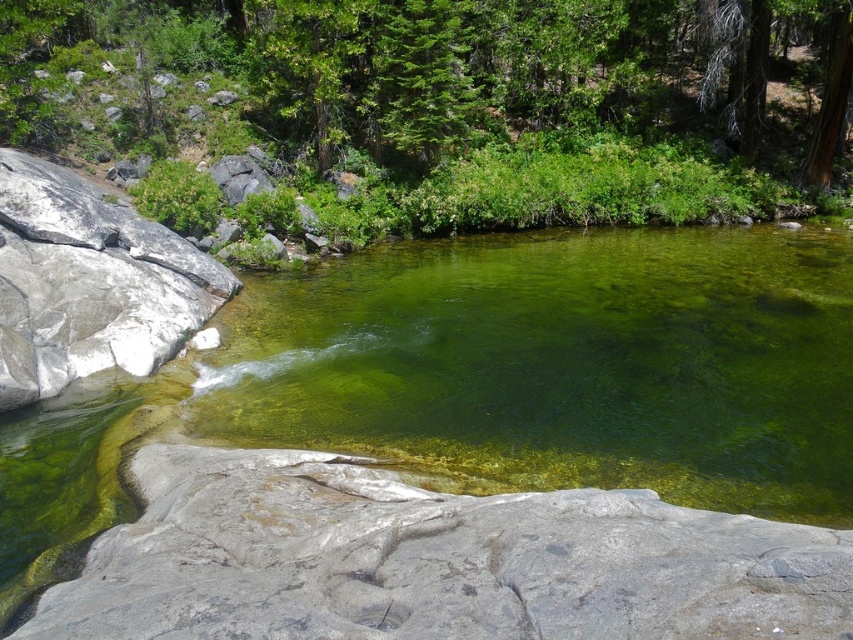
Can you confirm if green translucent water at center is smaller than gray rock at center?

No, green translucent water at center is not smaller than gray rock at center.

Which of these two, green translucent water at center or gray rock at center, stands shorter?

gray rock at center is shorter.

Who is more forward, (x=564, y=316) or (x=648, y=506)?

Positioned in front is point (x=648, y=506).

Locate an element on the screen. This screenshot has height=640, width=853. green translucent water at center is located at coordinates (468, 413).

Is point (167, 483) behind point (26, 252)?

No, it is in front of (26, 252).

You are a GUI agent. You are given a task and a screenshot of the screen. Output one action in this format:
    pyautogui.click(x=<x>, y=<y>)
    Task: Click on the green translucent water at center
    The width and height of the screenshot is (853, 640).
    Given the screenshot: What is the action you would take?
    point(468,413)

Locate an element on the screen. green translucent water at center is located at coordinates (468, 413).

Locate an element on the screen. This screenshot has width=853, height=640. green translucent water at center is located at coordinates (468, 413).

Consider the image. Measure the distance between point (201, 604) and camera.

A distance of 4.49 meters exists between point (201, 604) and camera.

Can you confirm if gray rock at center is positioned above gray rock at left?

No, gray rock at center is not above gray rock at left.

The width and height of the screenshot is (853, 640). Describe the element at coordinates (432, 561) in the screenshot. I see `gray rock at center` at that location.

Where is `gray rock at center`? The width and height of the screenshot is (853, 640). gray rock at center is located at coordinates [x=432, y=561].